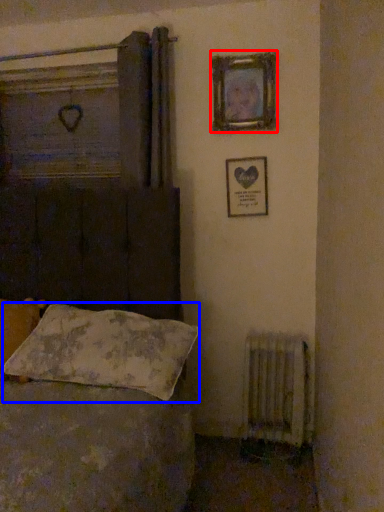
Question: Which object appears farthest to the camera in this image, picture frame (highlighted by a red box) or pillow (highlighted by a blue box)?

Choices:
 (A) picture frame
 (B) pillow

Answer: (A)